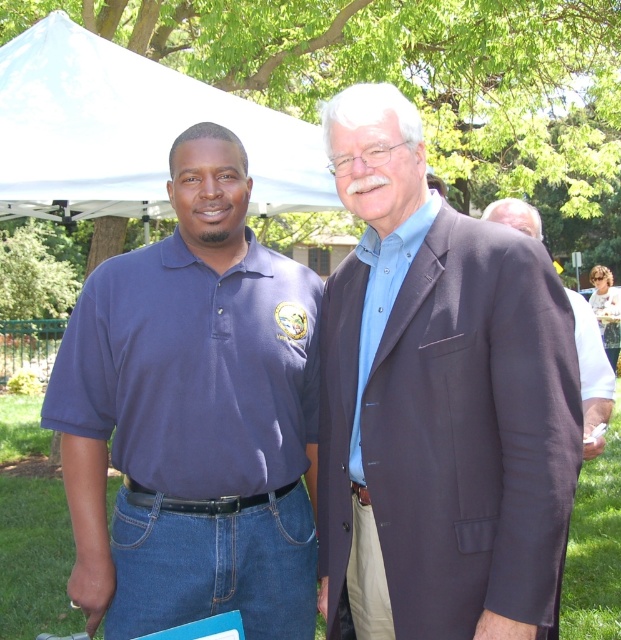
Question: Can you confirm if blue cotton shirt at center is positioned to the right of dark blue suit at center?

Choices:
 (A) yes
 (B) no

Answer: (B)

Question: Can you confirm if matte blue polo shirt at left is positioned above dark blue suit at center?

Choices:
 (A) no
 (B) yes

Answer: (A)

Question: Among these points, which one is farthest from the camera?

Choices:
 (A) (491, 214)
 (B) (65, 112)
 (C) (333, 504)
 (D) (229, 561)

Answer: (B)

Question: Based on their relative distances, which object is farther from the dark blue suit at center?

Choices:
 (A) blue cotton shirt at center
 (B) white fabric canopy at upper center
 (C) matte blue polo shirt at left

Answer: (B)

Question: In this image, where is blue cotton shirt at center located relative to dark blue suit at center?

Choices:
 (A) below
 (B) above

Answer: (A)

Question: Among these points, which one is farthest from the camera?

Choices:
 (A) (214, 220)
 (B) (460, 554)
 (C) (581, 308)

Answer: (C)